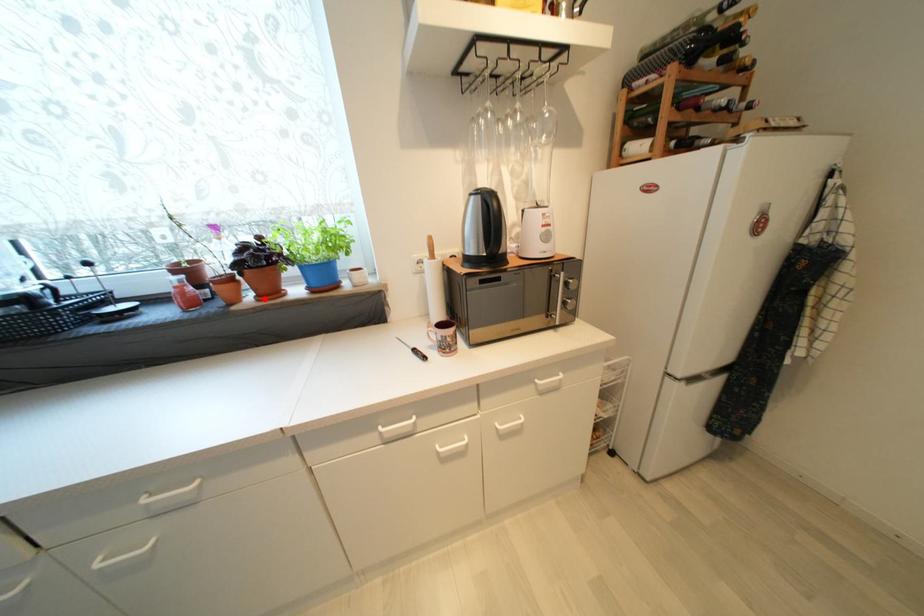
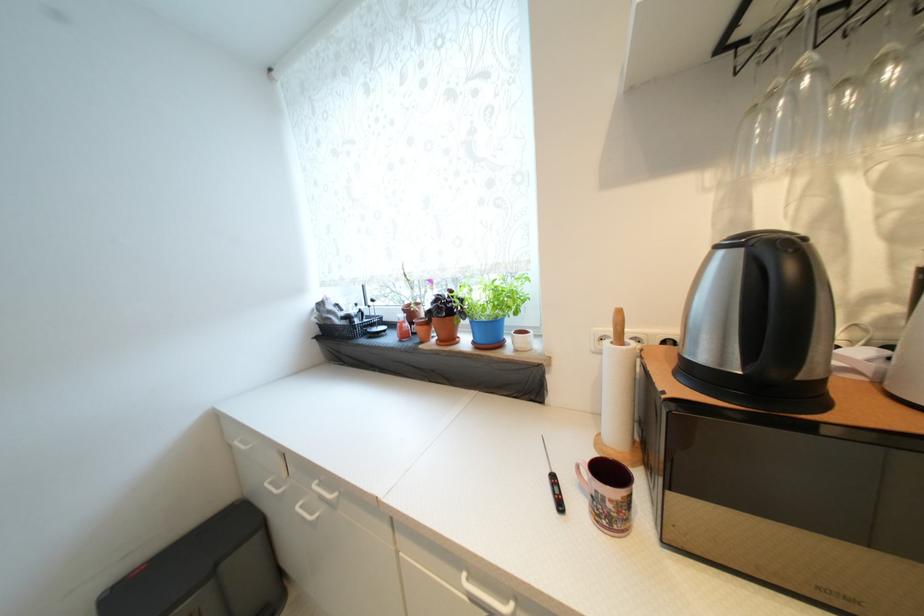
Locate, in the second image, the point that corresponds to the highlighted location in the first image.

(445, 342)